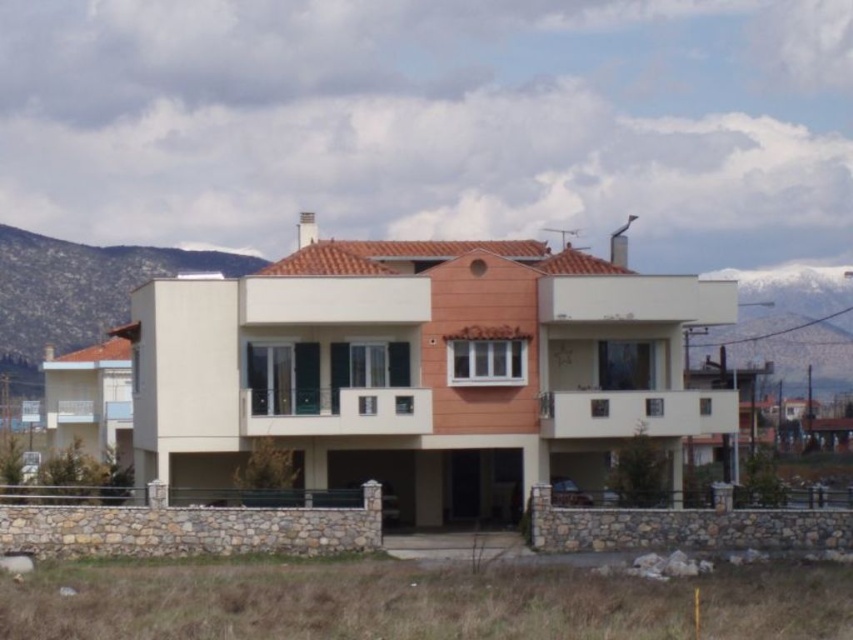
You are a drone operator planning to fly a drone between the brown stone mountain at upper left and the snowy white mountain at upper right. The drone has a maximum flight distance of 6 meters. Can the drone safely fly between them without exceeding its range?

The brown stone mountain at upper left is 6.18 meters from snowy white mountain at upper right. Since the distance is 6.18 meters and the drone can only fly 6 meters, the drone cannot safely fly between them without exceeding its range.

You are standing in front of the modern two story house and looking at the mountains in the background. Which mountain is positioned to the left side between the brown stone mountain at upper left and the snowy white mountain at upper right?

The brown stone mountain at upper left is positioned to the left of the snowy white mountain at upper right.

You are standing at the point labeled point (788, 374) and want to reach the front door of the house. The house is 135.08 meters away from you. Is the house within a 150 meter walking distance?

The house is 135.08 meters away from point (788, 374), so yes, it is within a 150 meter walking distance.